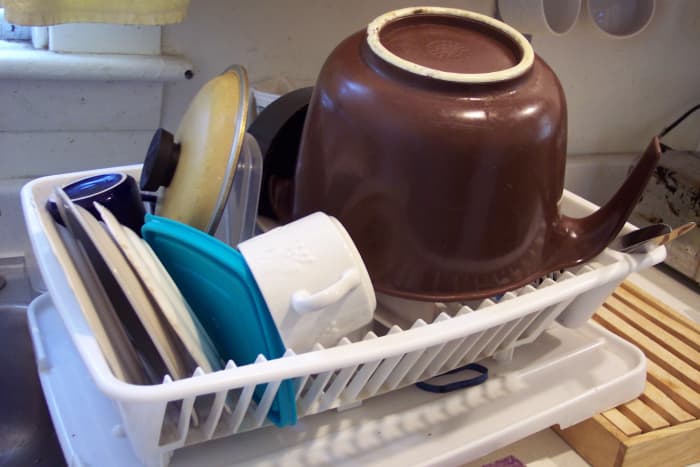
Where is `white kitchen wall`? The height and width of the screenshot is (467, 700). white kitchen wall is located at coordinates (312, 21).